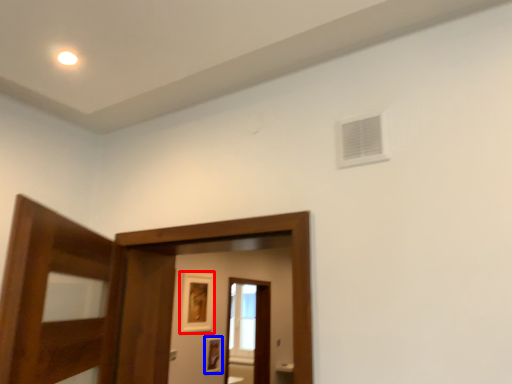
Question: Which object appears farthest to the camera in this image, picture frame (highlighted by a red box) or picture frame (highlighted by a blue box)?

Choices:
 (A) picture frame
 (B) picture frame

Answer: (B)